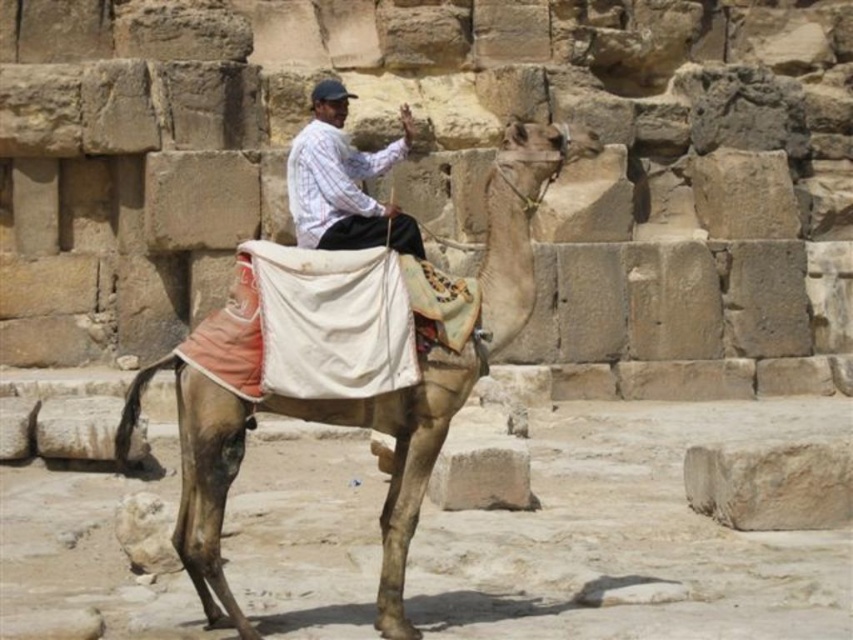
Question: Observing the image, what is the correct spatial positioning of brown textured camel at center in reference to white striped shirt at center?

Choices:
 (A) above
 (B) below

Answer: (B)

Question: Which of the following is the closest to the observer?

Choices:
 (A) (350, 170)
 (B) (387, 522)

Answer: (B)

Question: Does brown textured camel at center have a larger size compared to white striped shirt at center?

Choices:
 (A) yes
 (B) no

Answer: (A)

Question: Which object appears farthest from the camera in this image?

Choices:
 (A) white striped shirt at center
 (B) brown textured camel at center

Answer: (A)

Question: Does brown textured camel at center have a greater width compared to white striped shirt at center?

Choices:
 (A) no
 (B) yes

Answer: (B)

Question: Which object appears closest to the camera in this image?

Choices:
 (A) white striped shirt at center
 (B) brown textured camel at center

Answer: (B)